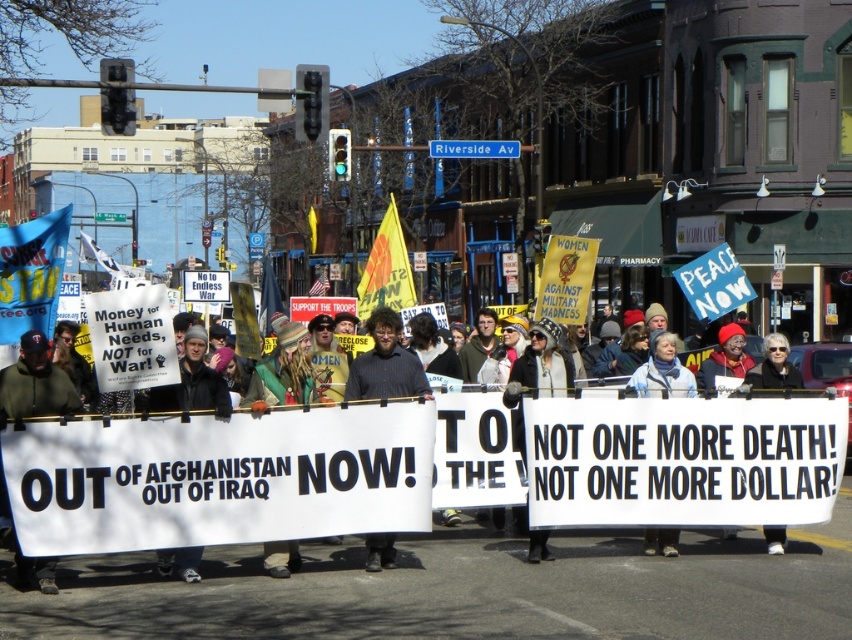
Question: Is white paper banner at center further to camera compared to white fabric sign at center?

Choices:
 (A) no
 (B) yes

Answer: (A)

Question: Which point is closer to the camera?

Choices:
 (A) (770, 346)
 (B) (396, 362)
 (C) (655, 333)
 (D) (10, 404)

Answer: (D)

Question: Which of the following is the farthest from the observer?

Choices:
 (A) dark gray shirt at center
 (B) white fabric sign at lower right
 (C) white fabric sign at center
 (D) black fabric sign at lower left

Answer: (B)

Question: In this image, where is dark gray shirt at center located relative to black leather jacket at center?

Choices:
 (A) above
 (B) below

Answer: (A)

Question: Considering the real-world distances, which object is closest to the white paper banner at center?

Choices:
 (A) black fabric sign at lower left
 (B) white fabric sign at center
 (C) white fabric sign at lower right
 (D) dark gray shirt at center

Answer: (A)

Question: Is black leather jacket at center smaller than white fabric sign at lower right?

Choices:
 (A) yes
 (B) no

Answer: (B)